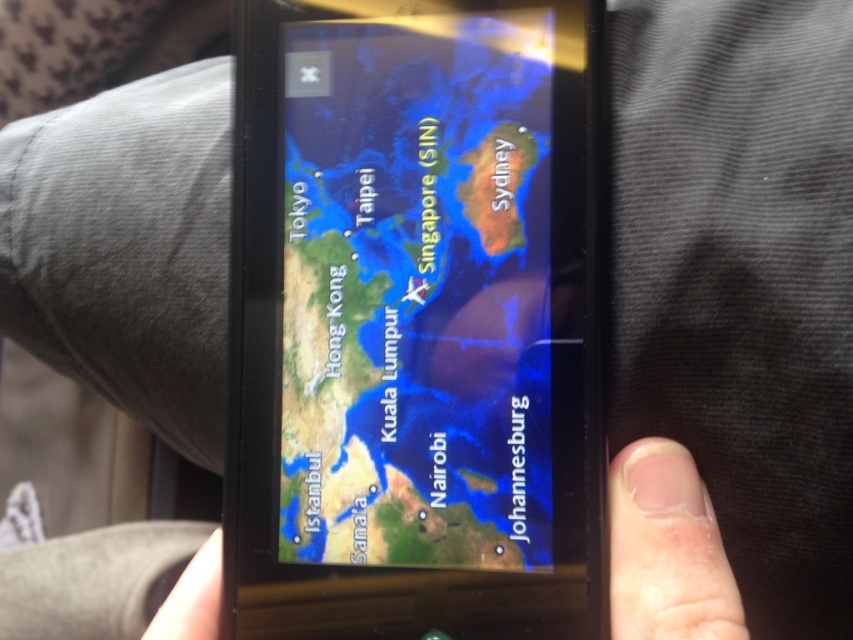
Question: Does satellite map at center lie in front of nail polish at lower right?

Choices:
 (A) no
 (B) yes

Answer: (A)

Question: Can you confirm if satellite map at center is positioned above nail polish at lower right?

Choices:
 (A) yes
 (B) no

Answer: (A)

Question: Which of the following is the farthest from the observer?

Choices:
 (A) nail polish at lower right
 (B) satellite map at center

Answer: (B)

Question: Is satellite map at center wider than nail polish at lower right?

Choices:
 (A) yes
 (B) no

Answer: (B)

Question: Which point appears farthest from the camera in this image?

Choices:
 (A) (502, 515)
 (B) (679, 476)

Answer: (A)